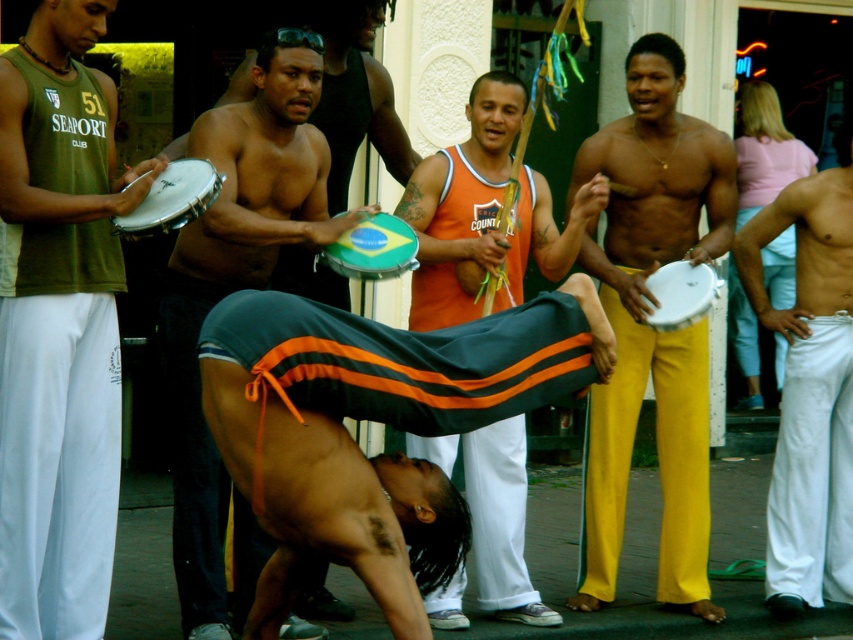
You are a photographer standing at the edge of the performance area. You want to capture a photo of the yellow cotton pants at center. Based on the coordinates provided, where should you position your camera relative to the main performer?

The yellow cotton pants at center are located at coordinates point (648, 328), so you should position your camera slightly to the right and lower than the main performer to capture them in the frame.

Looking at this image, you are a photographer setting up a tripod to capture the street performance. You want to ensure both the matte green tank top at left and the white cotton pants at right are clearly visible in your shot. Given their height difference, which object should you focus on first to frame the composition properly?

The matte green tank top at left is much taller than the white cotton pants at right, so you should focus on the matte green tank top at left first to ensure it is centered and properly framed before adjusting the shot to include the white cotton pants at right.

You are a photographer at the capoeira performance and want to capture a photo that includes both the black fabric pants at center and the orange jersey at center. Based on their positions, which one should you focus on first to ensure both are in frame?

The black fabric pants at center is positioned on the left side of orange jersey at center, so you should focus on the orange jersey at center first to ensure both are in frame.